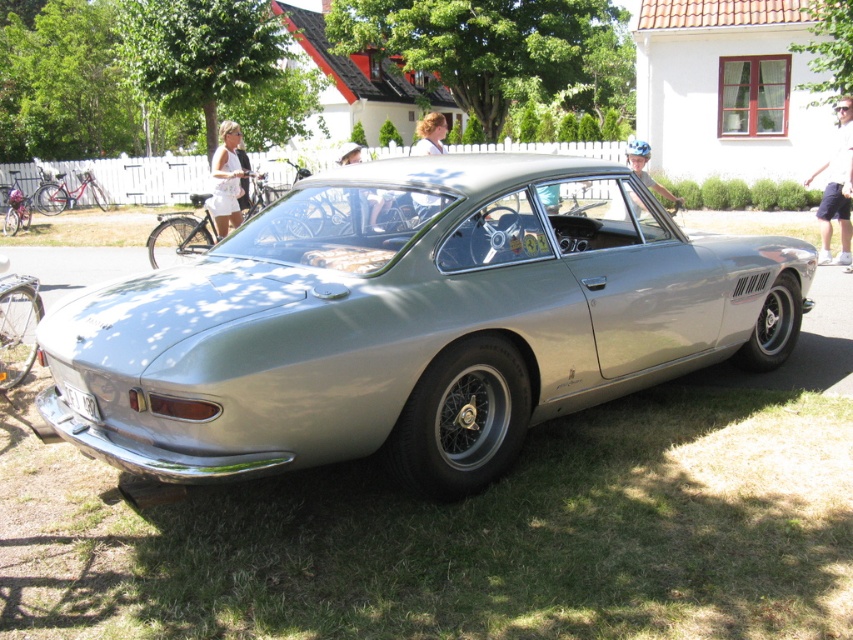
You are a delivery person who needs to place a package on the ground near the white fabric dress at upper center. Where should you place the package to ensure it is closest to the dress?

Place the package at point [225,179] to ensure it is closest to the white fabric dress at upper center.

You are a photographer planning to take a portrait of two people wearing white shorts at right and white fabric dress at upper center. You want to ensure both subjects are visible in the frame. Based on their positions, which subject should you place closer to the camera to avoid one blocking the other?

The white shorts at right is positioned on the right side of white fabric dress at upper center, so to avoid blocking, you should place the white fabric dress at upper center closer to the camera.